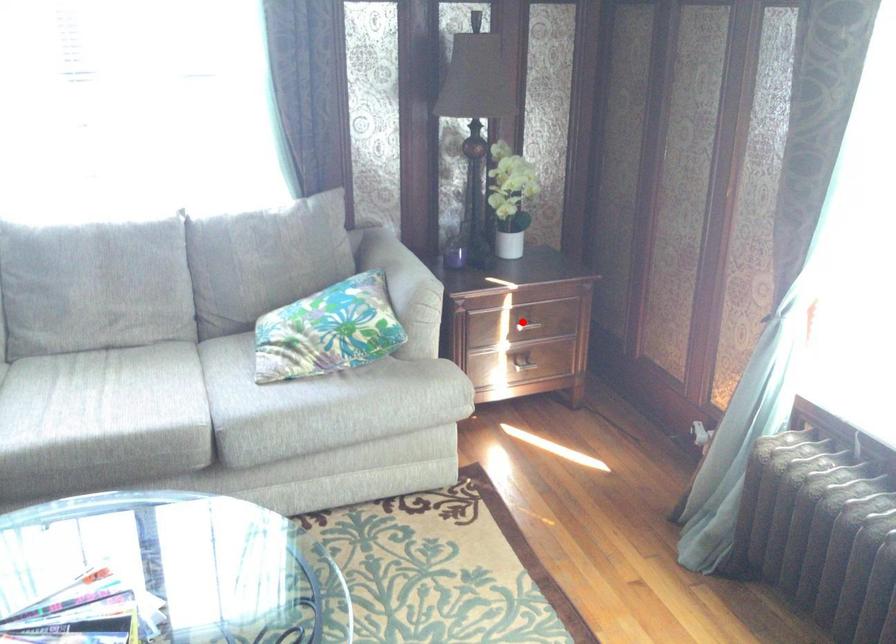
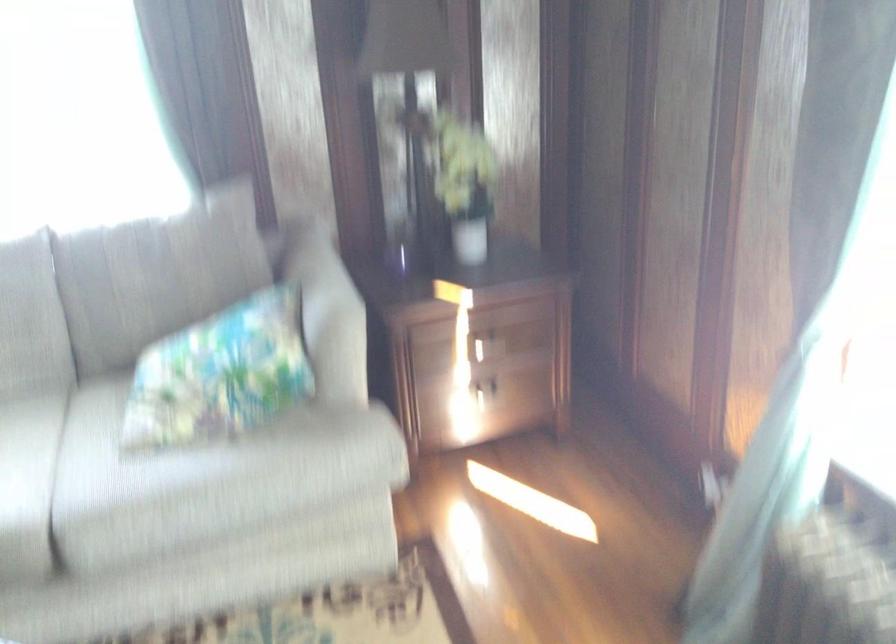
Question: I am providing you with two images of the same scene from different viewpoints. Given a red point in image1, look at the same physical point in image2. Is it:

Choices:
 (A) Closer to the viewpoint
 (B) Farther from the viewpoint

Answer: (A)